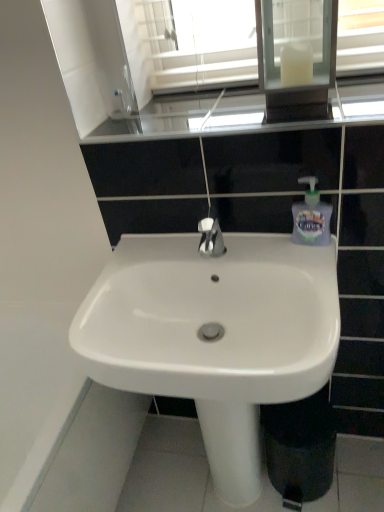
Identify the location of vacant space in front of white glass medicine cabinet at upper center. (317, 106).